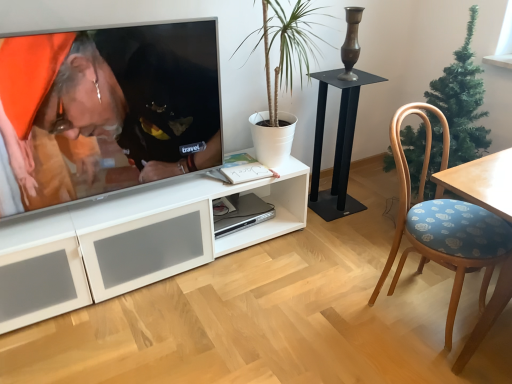
The image size is (512, 384). Find the location of `vacant point above sleek silver computer at center (from a real-world perspective)`. vacant point above sleek silver computer at center (from a real-world perspective) is located at coordinates (242, 211).